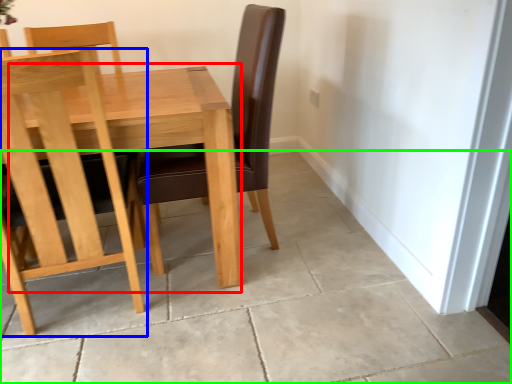
Question: Estimate the real-world distances between objects in this image. Which object is farther from table (highlighted by a red box), chair (highlighted by a blue box) or concrete (highlighted by a green box)?

Choices:
 (A) chair
 (B) concrete

Answer: (B)